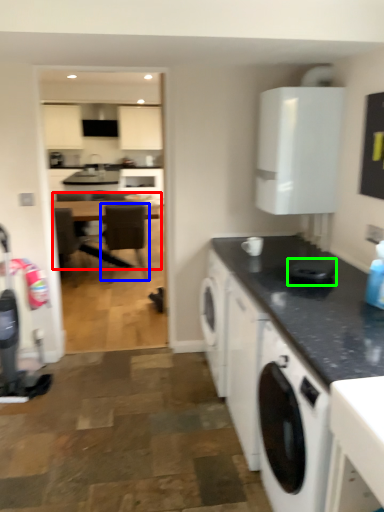
Question: Which is farther away from table (highlighted by a red box)? chair (highlighted by a blue box) or appliance (highlighted by a green box)?

Choices:
 (A) chair
 (B) appliance

Answer: (B)